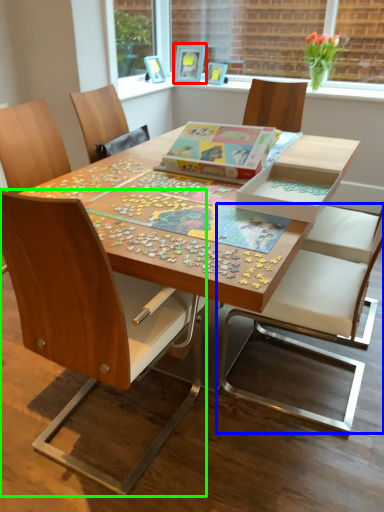
Question: Estimate the real-world distances between objects in this image. Which object is farther from picture frame (highlighted by a red box), chair (highlighted by a blue box) or chair (highlighted by a green box)?

Choices:
 (A) chair
 (B) chair

Answer: (B)